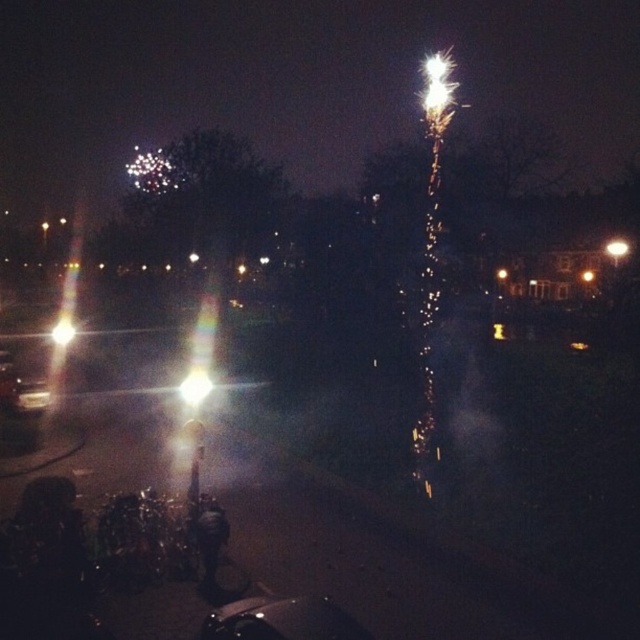
Who is positioned more to the left, bright metallic streetlight at left or bright white light at upper right?

bright metallic streetlight at left is more to the left.

Measure the distance between point (67, 339) and camera.

28.79 meters

Locate an element on the screen. bright metallic streetlight at left is located at coordinates (61, 332).

Image resolution: width=640 pixels, height=640 pixels. In order to click on bright metallic streetlight at left in this screenshot , I will do `click(61, 332)`.

Based on the photo, can you confirm if shiny metallic car at center is positioned below bright white light at center?

Correct, shiny metallic car at center is located below bright white light at center.

Which is in front, point (268, 627) or point (198, 372)?

Point (268, 627) is in front.

This screenshot has height=640, width=640. What are the coordinates of `shiny metallic car at center` in the screenshot? It's located at (282, 620).

Which is more to the right, shiny metallic car at center or bright yellow light at center?

bright yellow light at center

Is point (276, 604) in front of point (586, 269)?

Yes.

Which is in front, point (316, 625) or point (586, 269)?

Point (316, 625) is in front.

Where is `shiny metallic car at center`? The height and width of the screenshot is (640, 640). shiny metallic car at center is located at coordinates (282, 620).